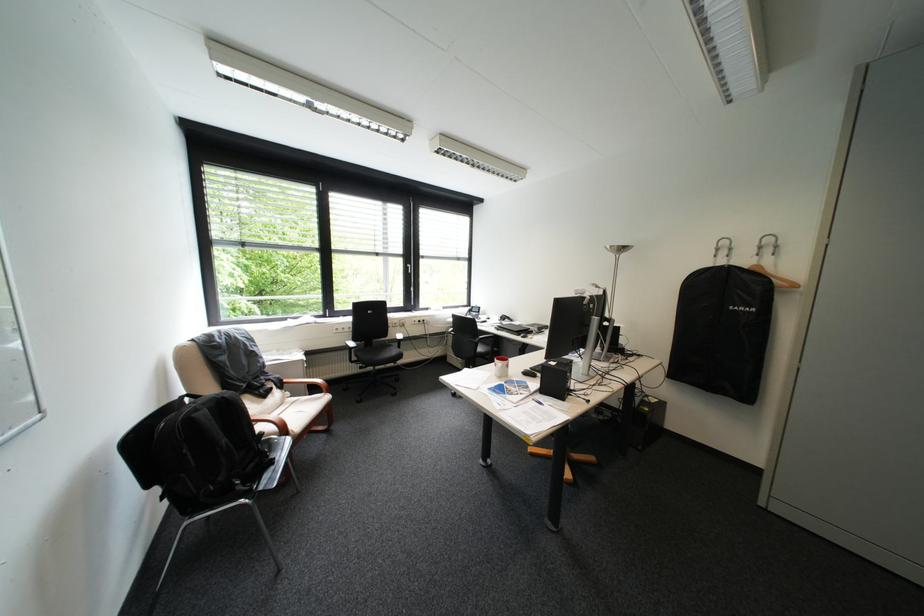
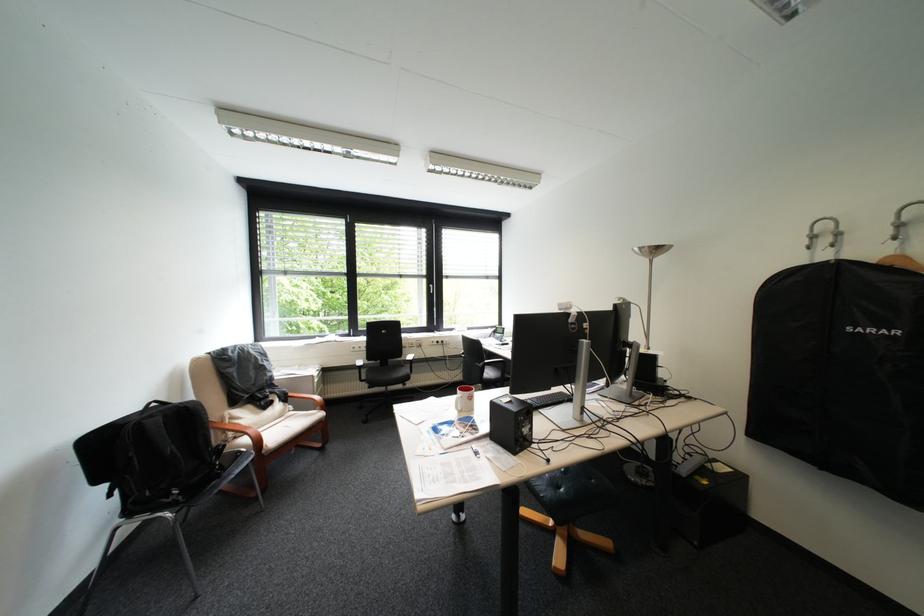
Locate, in the second image, the point that corresponds to pixel 362 349 in the first image.

(371, 368)